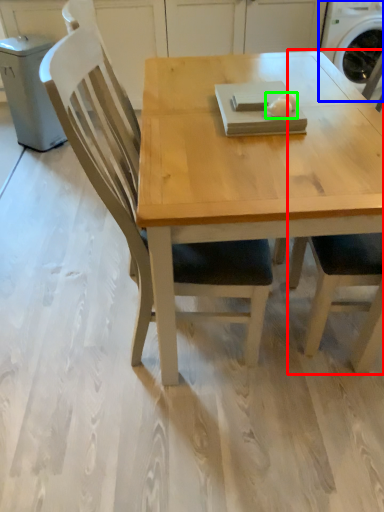
Question: Which is nearer to the chair (highlighted by a red box)? washing machine (highlighted by a blue box) or food (highlighted by a green box).

Choices:
 (A) washing machine
 (B) food

Answer: (B)